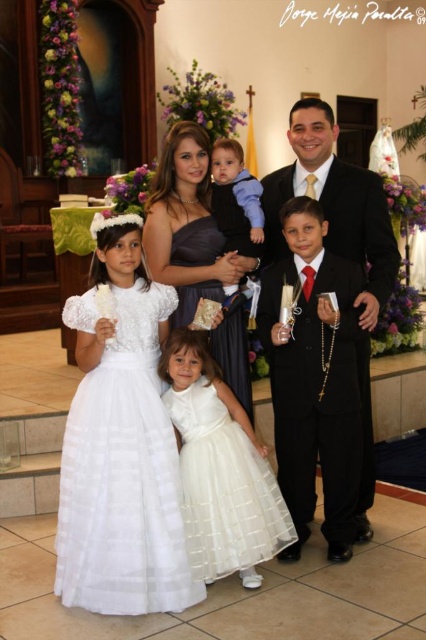
Question: Is white tulle dress at lower left thinner than dark blue velvet vest at center?

Choices:
 (A) yes
 (B) no

Answer: (B)

Question: Which point appears closest to the camera in this image?

Choices:
 (A) (172, 253)
 (B) (81, 532)
 (C) (233, 163)

Answer: (B)

Question: Does white tulle dress at center have a lesser width compared to matte dark blue dress at center?

Choices:
 (A) no
 (B) yes

Answer: (A)

Question: Which of these objects is positioned closest to the matte dark blue dress at center?

Choices:
 (A) white tulle dress at lower left
 (B) black satin suit at right
 (C) white tulle dress at center
 (D) dark blue velvet vest at center

Answer: (D)

Question: Which is farther from the black satin suit at right?

Choices:
 (A) dark blue velvet vest at center
 (B) white tulle dress at center
 (C) white tulle dress at lower left
 (D) matte dark blue dress at center

Answer: (C)

Question: Can you confirm if matte dark blue dress at center is positioned above dark blue velvet vest at center?

Choices:
 (A) yes
 (B) no

Answer: (B)